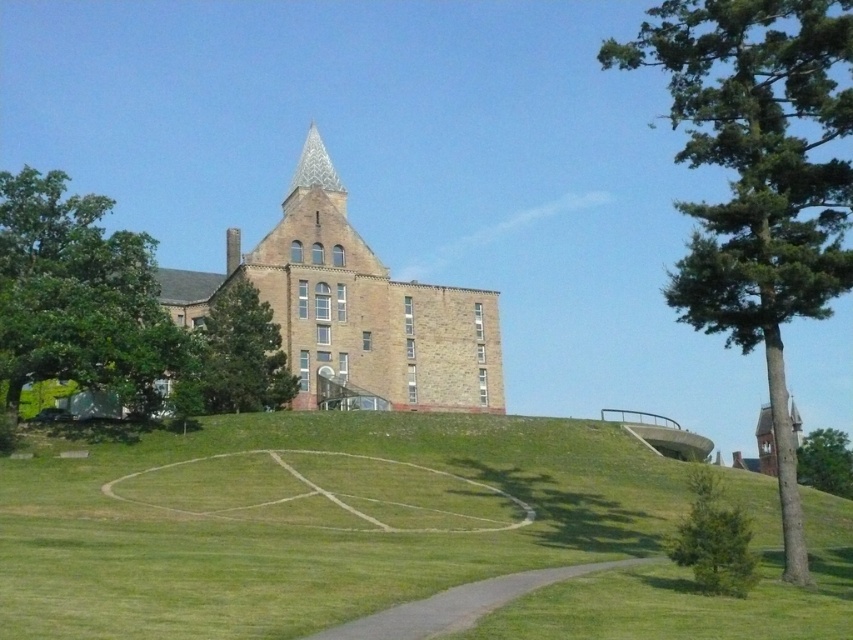
Question: Does green leafy tree at right appear under gray gravel path at lower center?

Choices:
 (A) yes
 (B) no

Answer: (B)

Question: Can you confirm if green leafy tree at left is wider than green leafy tree at center-right?

Choices:
 (A) no
 (B) yes

Answer: (B)

Question: Can you confirm if green leafy tree at center is wider than polished stone spire at upper center?

Choices:
 (A) no
 (B) yes

Answer: (A)

Question: Which object is farther from the camera taking this photo?

Choices:
 (A) polished stone spire at upper center
 (B) brown stone tower at center
 (C) gray gravel path at lower center
 (D) green textured pine at lower right

Answer: (A)

Question: Which object is the closest to the green grassy field at lower center?

Choices:
 (A) gray gravel path at lower center
 (B) brown stone tower at center

Answer: (A)

Question: Which object is closer to the camera taking this photo?

Choices:
 (A) green leafy tree at center-right
 (B) green grassy field at lower center
 (C) green leafy tree at right
 (D) polished stone spire at upper center

Answer: (B)